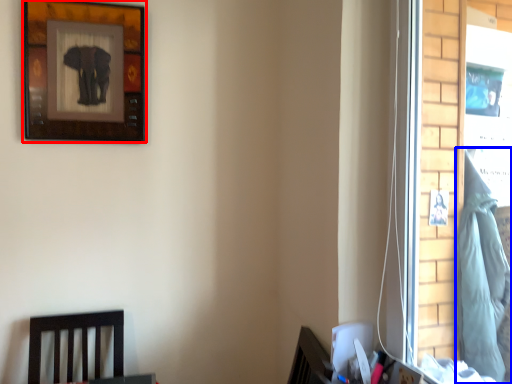
Question: Among these objects, which one is farthest to the camera, picture frame (highlighted by a red box) or laundry (highlighted by a blue box)?

Choices:
 (A) picture frame
 (B) laundry

Answer: (B)